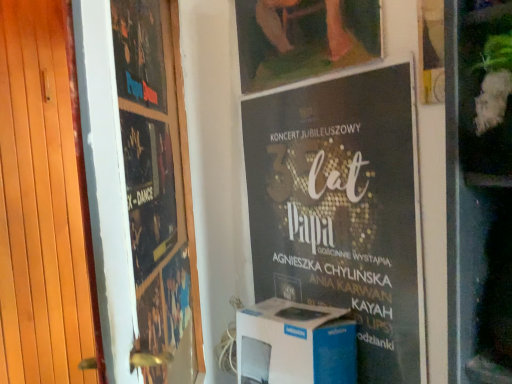
Question: Are matte black poster at left, placed as the 2th poster when sorted from left to right, and matte wooden picture frame at upper center making contact?

Choices:
 (A) no
 (B) yes

Answer: (A)

Question: Does matte black poster at left, placed as the 2th poster when sorted from left to right, have a larger size compared to matte wooden picture frame at upper center?

Choices:
 (A) yes
 (B) no

Answer: (A)

Question: Is matte black poster at left, which is the second poster from right to left, thinner than matte wooden picture frame at upper center?

Choices:
 (A) yes
 (B) no

Answer: (B)

Question: From a real-world perspective, is matte black poster at left, placed as the 2th poster when sorted from left to right, below matte wooden picture frame at upper center?

Choices:
 (A) yes
 (B) no

Answer: (A)

Question: Is matte black poster at left, which is the second poster from right to left, turned away from matte wooden picture frame at upper center?

Choices:
 (A) yes
 (B) no

Answer: (B)

Question: In terms of width, does wooden at left look wider or thinner when compared to matte black poster at upper left, the third poster positioned from the right?

Choices:
 (A) thin
 (B) wide

Answer: (B)

Question: Is point (78, 162) closer or farther from the camera than point (138, 29)?

Choices:
 (A) farther
 (B) closer

Answer: (B)

Question: From the image's perspective, relative to matte black poster at upper left, placed as the first poster when sorted from left to right, is wooden at left above or below?

Choices:
 (A) below
 (B) above

Answer: (A)

Question: Which is correct: wooden at left is inside matte black poster at upper left, placed as the first poster when sorted from left to right, or outside of it?

Choices:
 (A) outside
 (B) inside

Answer: (A)

Question: Is matte black poster at left, placed as the 2th poster when sorted from left to right, taller or shorter than matte wooden picture frame at upper center?

Choices:
 (A) tall
 (B) short

Answer: (A)

Question: From a real-world perspective, is matte black poster at left, which is the second poster from right to left, above or below matte wooden picture frame at upper center?

Choices:
 (A) above
 (B) below

Answer: (B)

Question: Is point (174, 332) closer or farther from the camera than point (273, 64)?

Choices:
 (A) closer
 (B) farther

Answer: (A)

Question: Looking at their shapes, would you say matte black poster at left, placed as the 2th poster when sorted from left to right, is wider or thinner than matte wooden picture frame at upper center?

Choices:
 (A) thin
 (B) wide

Answer: (B)

Question: Is black paper poster at center, which appears as the 1th poster when viewed from the right, to the left or to the right of wooden at left in the image?

Choices:
 (A) right
 (B) left

Answer: (A)

Question: Based on their sizes in the image, would you say black paper poster at center, placed as the third poster when sorted from left to right, is bigger or smaller than wooden at left?

Choices:
 (A) big
 (B) small

Answer: (B)